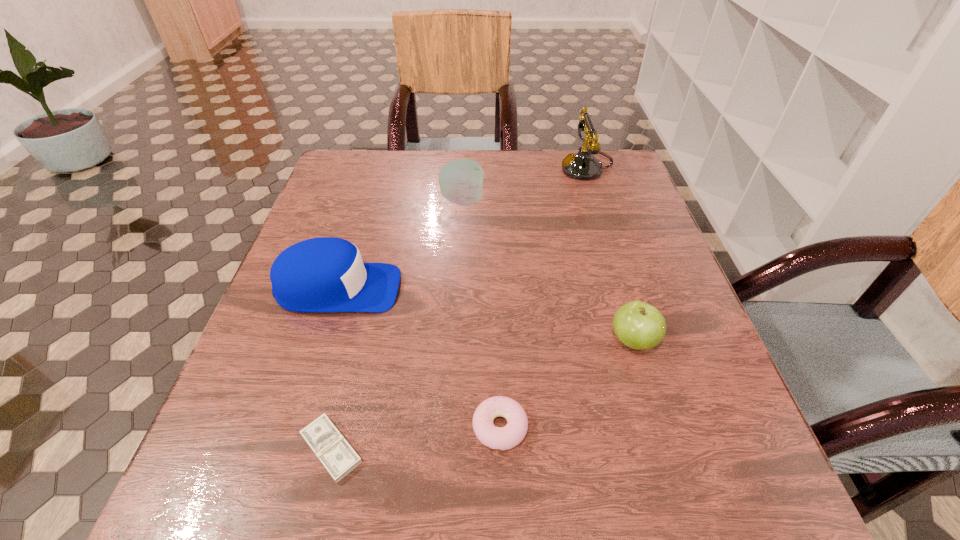
Find the location of `telephone that is at the right edge`. telephone that is at the right edge is located at coordinates (583, 165).

Identify the location of apple situated at the right edge. The width and height of the screenshot is (960, 540). coord(638,325).

Locate an element on the screen. The height and width of the screenshot is (540, 960). object located in the near left corner section of the desktop is located at coordinates (338, 457).

Locate an element on the screen. The width and height of the screenshot is (960, 540). object located in the far right corner section of the desktop is located at coordinates (583, 165).

This screenshot has width=960, height=540. In order to click on free space at the far edge in this screenshot , I will do `click(499, 188)`.

Locate an element on the screen. The image size is (960, 540). vacant space at the near edge is located at coordinates (358, 487).

This screenshot has width=960, height=540. In the image, there is a desktop. Find the location of `free space at the right edge`. free space at the right edge is located at coordinates (668, 392).

At what (x,y) coordinates should I click in order to perform the action: click on free spot at the far left corner of the desktop. Please return your answer as a coordinate pair (x, y). This screenshot has width=960, height=540. Looking at the image, I should click on (340, 150).

What are the coordinates of `free space between the money and the fourth nearest object` in the screenshot? It's located at (335, 369).

I want to click on free space between the doughnut and the tallest object, so click(543, 298).